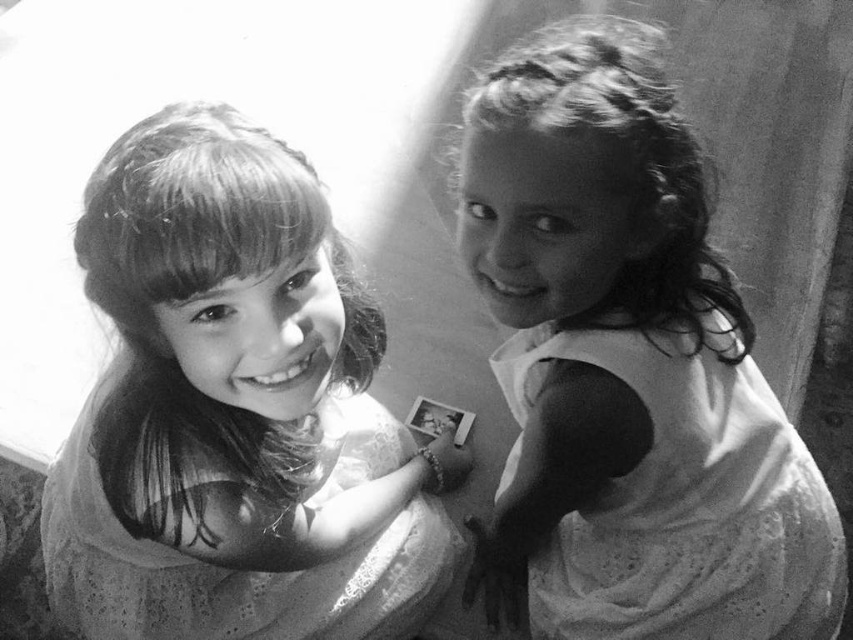
The image size is (853, 640). Identify the location of smooth white dress at right. (627, 368).

Does point (657, 74) come closer to viewer compared to point (697, 406)?

Yes, point (657, 74) is closer to viewer.

Who is more forward, (706,368) or (643,636)?

Point (706,368)

This screenshot has width=853, height=640. Find the location of `smooth white dress at right`. smooth white dress at right is located at coordinates (627, 368).

Between smooth white dress at right and smooth fabric dress at upper left, which one has more height?

smooth white dress at right

Is smooth white dress at right below smooth fabric dress at upper left?

No, smooth white dress at right is not below smooth fabric dress at upper left.

Who is more forward, (x=535, y=544) or (x=267, y=300)?

Point (x=267, y=300) is in front.

What are the coordinates of `smooth white dress at right` in the screenshot? It's located at (627, 368).

Which is in front, point (144, 452) or point (778, 593)?

Positioned in front is point (144, 452).

Which of these two, smooth fabric dress at upper left or white lace dress at right, stands shorter?

white lace dress at right is shorter.

Which is in front, point (157, 232) or point (650, 464)?

Point (157, 232) is more forward.

I want to click on smooth fabric dress at upper left, so click(235, 410).